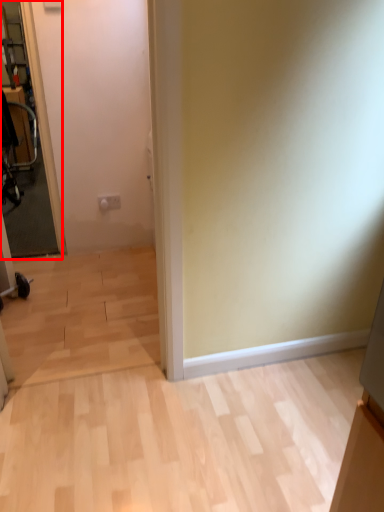
Question: From the image, what is the correct spatial relationship of glass door (annotated by the red box) in relation to swivel chair?

Choices:
 (A) left
 (B) right

Answer: (B)